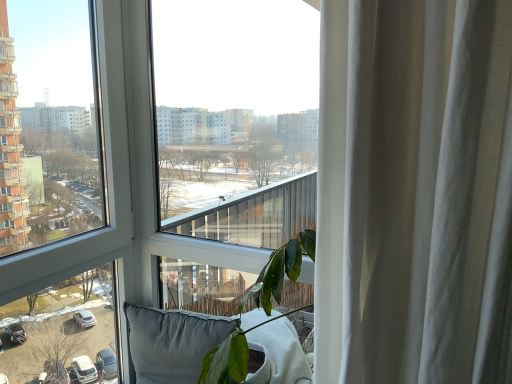
Question: In which direction should I rotate to look at transparent glass window at center, which is the second window from left to right?

Choices:
 (A) left
 (B) right

Answer: (A)

Question: Is gray fabric pillow at lower center smaller than transparent glass window at center, the first window when ordered from left to right?

Choices:
 (A) no
 (B) yes

Answer: (B)

Question: Is gray fabric pillow at lower center closer to the viewer compared to transparent glass window at center, which is the second window in right-to-left order?

Choices:
 (A) no
 (B) yes

Answer: (A)

Question: Is there a large distance between gray fabric pillow at lower center and transparent glass window at center, which is the second window in right-to-left order?

Choices:
 (A) no
 (B) yes

Answer: (A)

Question: From a real-world perspective, is gray fabric pillow at lower center located higher than transparent glass window at center, which is the second window in right-to-left order?

Choices:
 (A) no
 (B) yes

Answer: (A)

Question: Would you say transparent glass window at center, the first window when ordered from left to right, is part of gray fabric pillow at lower center's contents?

Choices:
 (A) no
 (B) yes

Answer: (A)

Question: Is gray fabric pillow at lower center outside transparent glass window at center, the first window when ordered from left to right?

Choices:
 (A) no
 (B) yes

Answer: (B)

Question: Considering the relative sizes of transparent glass window at center, which is the second window in right-to-left order, and transparent glass window at center, which is the second window from left to right, in the image provided, is transparent glass window at center, which is the second window in right-to-left order, bigger than transparent glass window at center, which is the second window from left to right,?

Choices:
 (A) yes
 (B) no

Answer: (B)

Question: Can you see transparent glass window at center, which is the second window in right-to-left order, touching transparent glass window at center, positioned as the first window in right-to-left order?

Choices:
 (A) yes
 (B) no

Answer: (B)

Question: Is transparent glass window at center, the first window when ordered from left to right, turned away from transparent glass window at center, positioned as the first window in right-to-left order?

Choices:
 (A) yes
 (B) no

Answer: (B)

Question: Considering the relative sizes of transparent glass window at center, the first window when ordered from left to right, and transparent glass window at center, which is the second window from left to right, in the image provided, is transparent glass window at center, the first window when ordered from left to right, shorter than transparent glass window at center, which is the second window from left to right,?

Choices:
 (A) no
 (B) yes

Answer: (A)

Question: From a real-world perspective, is transparent glass window at center, the first window when ordered from left to right, located beneath transparent glass window at center, which is the second window from left to right?

Choices:
 (A) no
 (B) yes

Answer: (B)

Question: Is transparent glass window at center, the first window when ordered from left to right, positioned in front of transparent glass window at center, positioned as the first window in right-to-left order?

Choices:
 (A) yes
 (B) no

Answer: (A)

Question: Considering the relative sizes of transparent glass window at center, positioned as the first window in right-to-left order, and gray fabric pillow at lower center in the image provided, is transparent glass window at center, positioned as the first window in right-to-left order, bigger than gray fabric pillow at lower center?

Choices:
 (A) no
 (B) yes

Answer: (B)